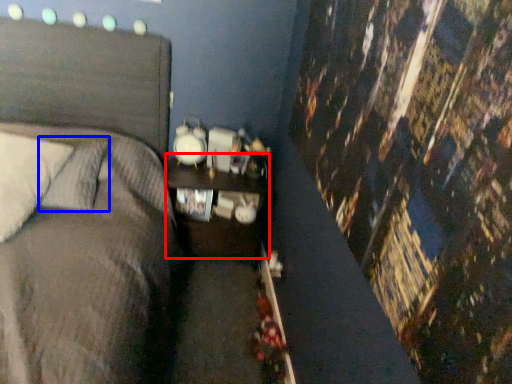
Question: Which point is closer to the camera, nightstand (highlighted by a red box) or pillow (highlighted by a blue box)?

Choices:
 (A) nightstand
 (B) pillow

Answer: (B)